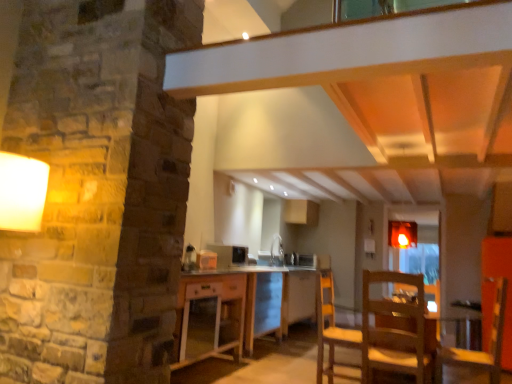
Question: From a real-world perspective, is satin black microwave at center, the second appliance from the right, above or below wooden chair at lower right, the 1th chair from the left?

Choices:
 (A) below
 (B) above

Answer: (B)

Question: In terms of width, does satin black microwave at center, which appears as the 2th appliance when viewed from the back, look wider or thinner when compared to wooden chair at lower right, which appears as the second chair when viewed from the right?

Choices:
 (A) thin
 (B) wide

Answer: (A)

Question: Which is nearer to the wooden table at center?

Choices:
 (A) white glossy microwave at center, which is the 1th appliance from back to front
 (B) transparent glass door at center
 (C) white glossy sink at center
 (D) satin black microwave at center, which appears as the first appliance when viewed from the left
 (E) wooden chair at lower right, which appears as the second chair when viewed from the right

Answer: (D)

Question: Estimate the real-world distances between objects in this image. Which object is closer to the white glossy microwave at center, which ranks as the 1th appliance in bottom-to-top order?

Choices:
 (A) satin black microwave at center, marked as the 1th appliance in a front-to-back arrangement
 (B) transparent glass door at center
 (C) wooden chair at lower right, which is counted as the second chair, starting from the left
 (D) wooden table at center
 (E) wooden chair at lower right, the 1th chair from the left

Answer: (D)